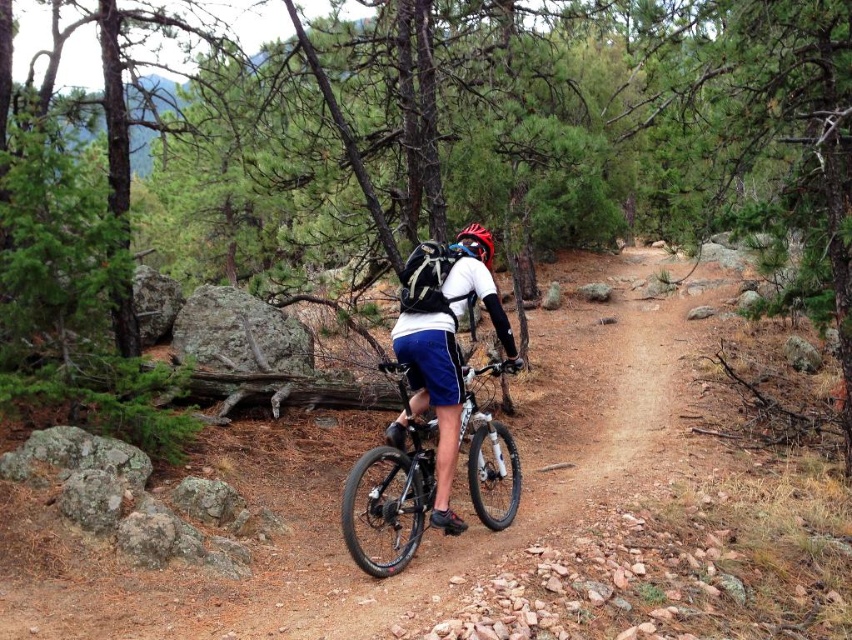
You are a photographer trying to capture the mountain biker. You notice the matte blue shorts at center and the shiny black frame at center in your viewfinder. Which object appears wider in the photo?

The shiny black frame at center appears wider than the matte blue shorts at center since the matte blue shorts at center has a smaller width according to the description.

You are a photographer standing at point (390,499) in the scene. You want to capture a clear photo of the mountain biker. Is there any object blocking your view of the biker?

Yes, the shiny black frame at center is blocking your view of the mountain biker.